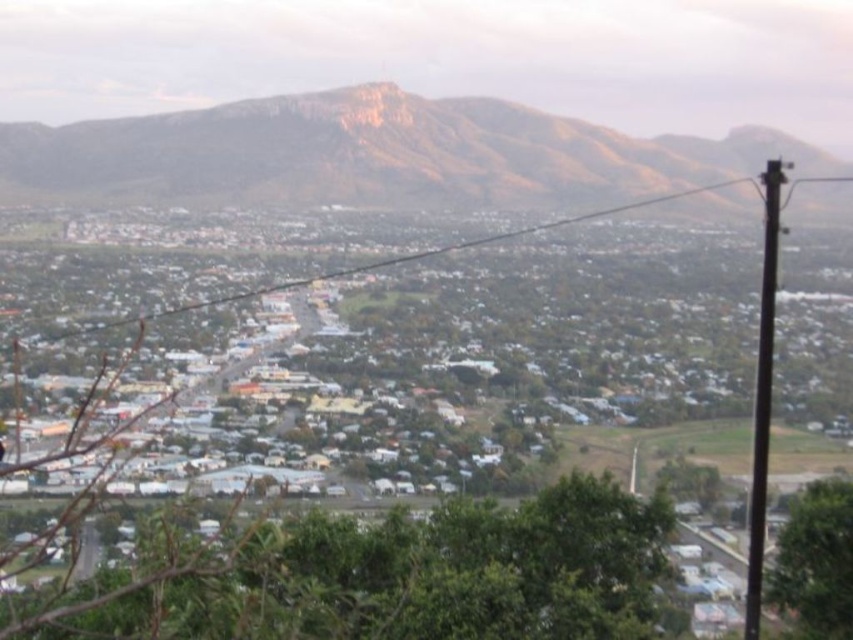
Question: Which of these objects is positioned farthest from the black metallic pole at right?

Choices:
 (A) rustic stone mountain at upper center
 (B) black wire at center
 (C) green leafy tree at center
 (D) green leafy tree at lower right

Answer: (A)

Question: Does rustic stone mountain at upper center come behind black metallic pole at right?

Choices:
 (A) no
 (B) yes

Answer: (B)

Question: Which object is positioned closest to the black wire at center?

Choices:
 (A) green leafy tree at center
 (B) green leafy tree at lower right
 (C) black metallic pole at right
 (D) rustic stone mountain at upper center

Answer: (D)

Question: Does rustic stone mountain at upper center lie behind green leafy tree at lower right?

Choices:
 (A) yes
 (B) no

Answer: (A)

Question: Does green leafy tree at lower right come in front of black wire at center?

Choices:
 (A) yes
 (B) no

Answer: (B)

Question: Among these points, which one is farthest from the camera?

Choices:
 (A) (x=540, y=227)
 (B) (x=767, y=205)

Answer: (A)